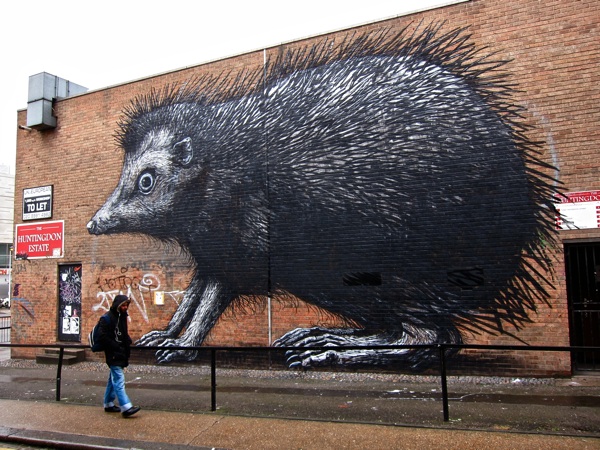
The image size is (600, 450). I want to click on door, so click(70, 301).